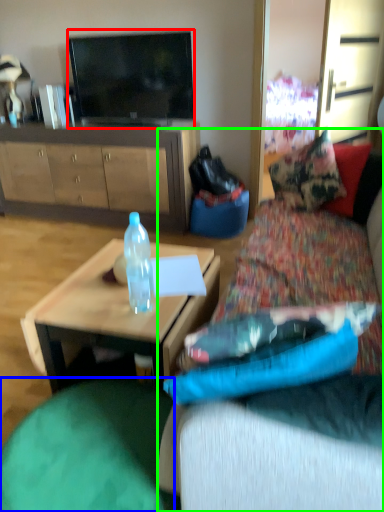
Question: Which object is the farthest from television (highlighted by a red box)? Choose among these: bean bag chair (highlighted by a blue box) or studio couch (highlighted by a green box).

Choices:
 (A) bean bag chair
 (B) studio couch

Answer: (B)